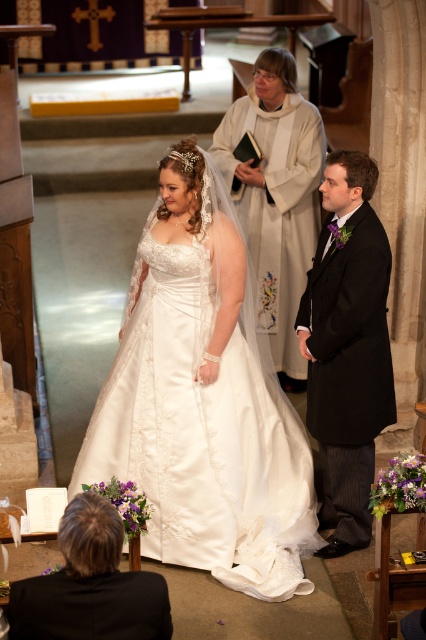
Question: Which of the following is the closest to the observer?

Choices:
 (A) satin/embroidered dress at center
 (B) matte black suit at right
 (C) black suit at lower left

Answer: (C)

Question: Considering the real-world distances, which object is closest to the matte black suit at right?

Choices:
 (A) satin/embroidered dress at center
 (B) satin dress at center

Answer: (A)

Question: Does satin/embroidered dress at center have a greater width compared to matte black suit at right?

Choices:
 (A) yes
 (B) no

Answer: (A)

Question: Can you confirm if matte black suit at right is thinner than satin dress at center?

Choices:
 (A) no
 (B) yes

Answer: (B)

Question: Which point is closer to the camera?

Choices:
 (A) black suit at lower left
 (B) satin dress at center

Answer: (A)

Question: Is satin/embroidered dress at center above black suit at lower left?

Choices:
 (A) yes
 (B) no

Answer: (A)